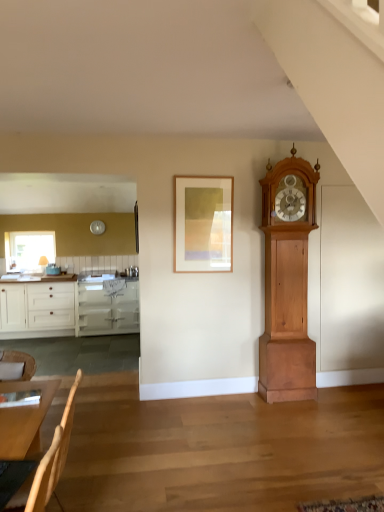
Question: Would you say light brown wooden grandfather clock at right is to the left or to the right of light brown wooden table at lower left in the picture?

Choices:
 (A) right
 (B) left

Answer: (A)

Question: Considering the positions of light brown wooden grandfather clock at right and light brown wooden table at lower left in the image, is light brown wooden grandfather clock at right wider or thinner than light brown wooden table at lower left?

Choices:
 (A) thin
 (B) wide

Answer: (B)

Question: Estimate the real-world distances between objects in this image. Which object is farther from the matte glass window at left?

Choices:
 (A) light wood armchair at lower left
 (B) light brown wooden grandfather clock at right
 (C) white glossy cabinetry at left
 (D) light brown wooden table at lower left
 (E) wooden picture frame at center

Answer: (A)

Question: Estimate the real-world distances between objects in this image. Which object is farther from the light brown wooden grandfather clock at right?

Choices:
 (A) wooden chair at lower left
 (B) wooden picture frame at center
 (C) white glossy cabinetry at left
 (D) light brown wooden table at lower left
 (E) light wood armchair at lower left

Answer: (C)